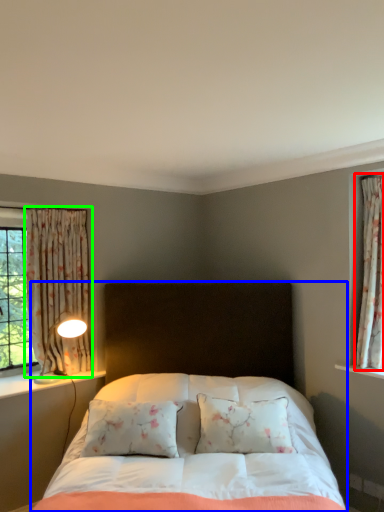
Question: Based on their relative distances, which object is nearer to curtain (highlighted by a red box)? Choose from bed (highlighted by a blue box) and curtain (highlighted by a green box).

Choices:
 (A) bed
 (B) curtain

Answer: (A)